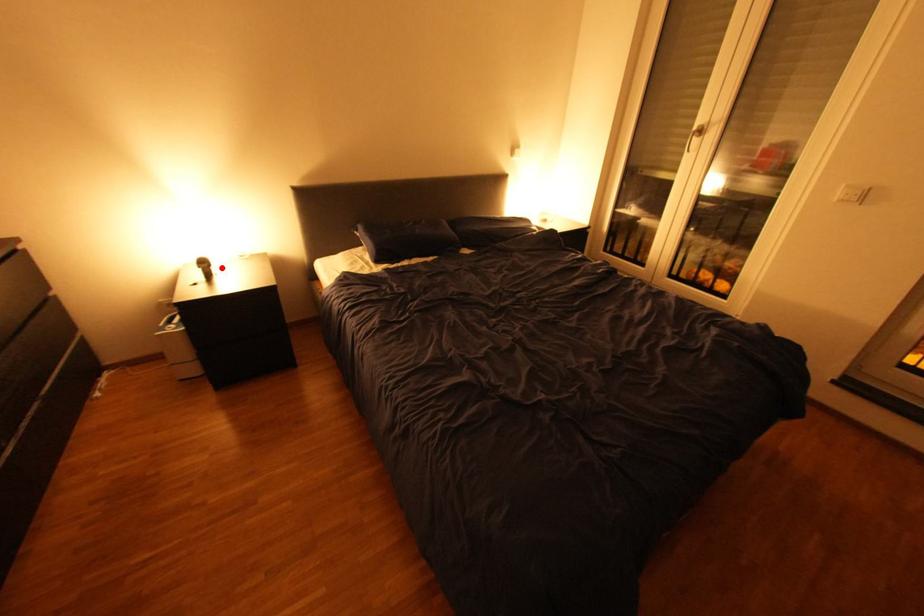
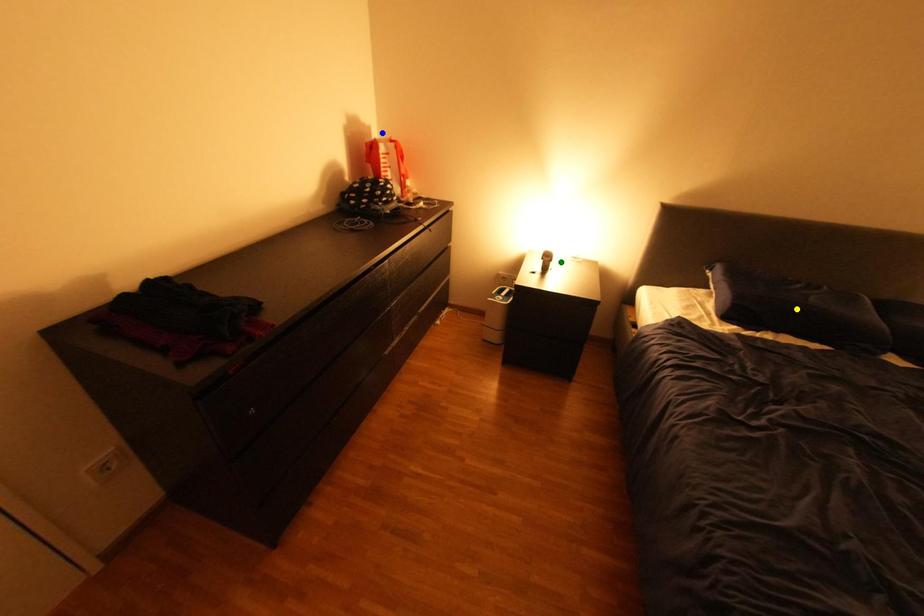
Question: I am providing you with two images of the same scene from different viewpoints. A red point is marked on the first image. You are given multiple points on the second image. Which spot in image 2 lines up with the point in image 1?

Choices:
 (A) blue point
 (B) green point
 (C) yellow point

Answer: (B)